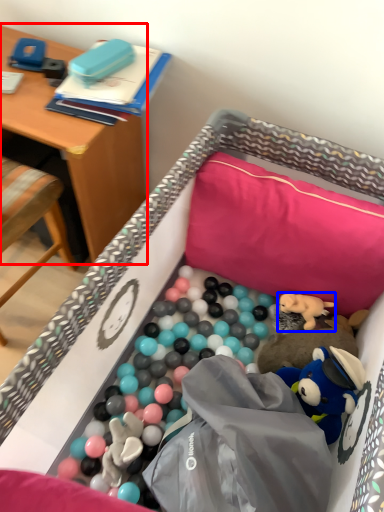
Question: Which object appears closest to the camera in this image, desk (highlighted by a red box) or toy (highlighted by a blue box)?

Choices:
 (A) desk
 (B) toy

Answer: (A)